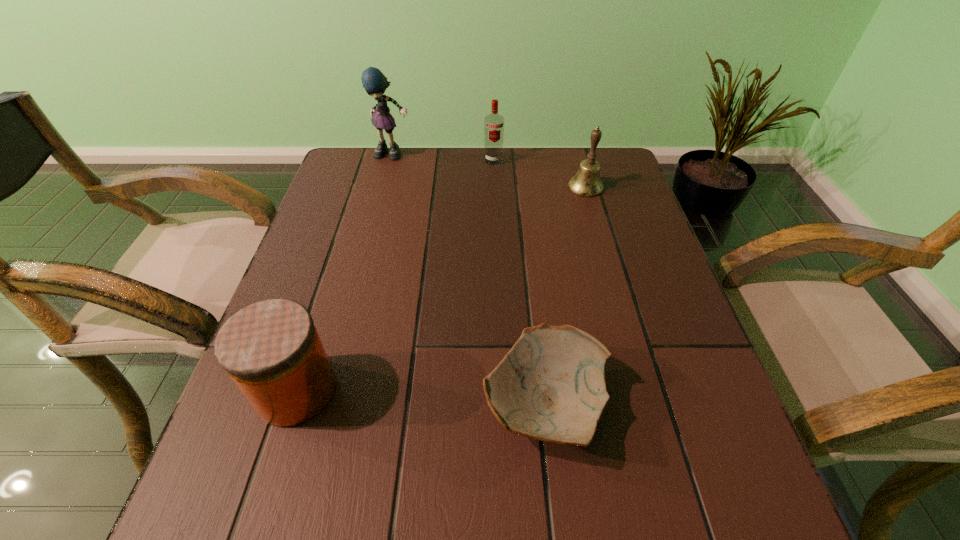
You are a GUI agent. You are given a task and a screenshot of the screen. Output one action in this format:
    pyautogui.click(x=<x>, y=<y>)
    Task: Click on the vacant space in between the rightmost object and the vodka
    This screenshot has width=960, height=540.
    Given the screenshot: What is the action you would take?
    pyautogui.click(x=540, y=173)

Find the location of `vacant area that lies between the rag doll and the bell`. vacant area that lies between the rag doll and the bell is located at coordinates (490, 171).

Locate an element on the screen. This screenshot has width=960, height=540. free space between the jar and the third farthest object is located at coordinates (441, 288).

You are a GUI agent. You are given a task and a screenshot of the screen. Output one action in this format:
    pyautogui.click(x=<x>, y=<y>)
    Task: Click on the vacant area that lies between the rightmost object and the jar
    The height and width of the screenshot is (540, 960).
    Given the screenshot: What is the action you would take?
    pyautogui.click(x=441, y=288)

Locate an element on the screen. This screenshot has width=960, height=540. free spot between the third farthest object and the vodka is located at coordinates tap(540, 173).

The width and height of the screenshot is (960, 540). What are the coordinates of `the fourth closest object to the pottery` in the screenshot? It's located at click(374, 82).

Locate an element on the screen. object that stands as the third closest to the vodka is located at coordinates (551, 385).

At what (x,y) coordinates should I click in order to perform the action: click on vacant area in the image that satisfies the following two spatial constraints: 1. on the front label of the rightmost object; 2. on the left side of the vodka. Please return your answer as a coordinate pair (x, y). The image size is (960, 540). Looking at the image, I should click on (494, 187).

The height and width of the screenshot is (540, 960). I want to click on vacant point that satisfies the following two spatial constraints: 1. on the front label of the vodka; 2. on the left side of the third nearest object, so click(x=494, y=187).

Locate an element on the screen. blank area in the image that satisfies the following two spatial constraints: 1. on the front side of the jar; 2. on the right side of the pottery is located at coordinates (292, 403).